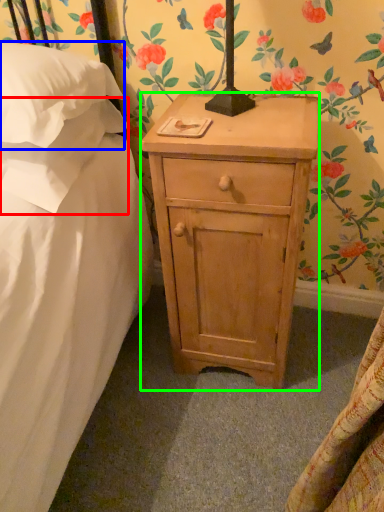
Question: Estimate the real-world distances between objects in this image. Which object is closer to pillow (highlighted by a red box), pillow (highlighted by a blue box) or nightstand (highlighted by a green box)?

Choices:
 (A) pillow
 (B) nightstand

Answer: (A)